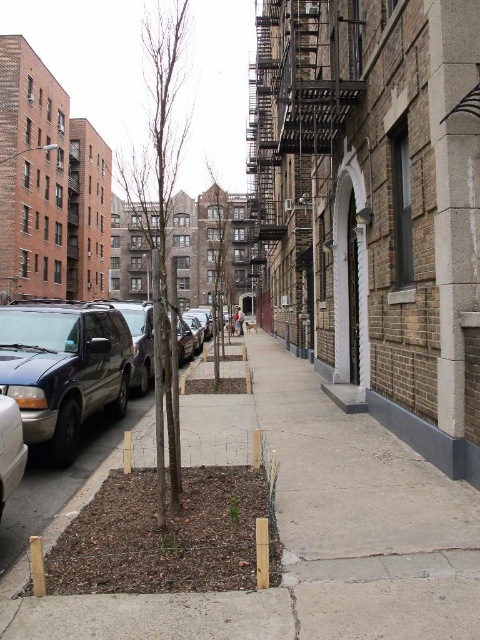
Is point (15, 312) farther from camera compared to point (214, 250)?

No, it is not.

Who is positioned more to the left, metallic blue van at left or green matte tree at center?

From the viewer's perspective, green matte tree at center appears more on the left side.

Which is behind, point (47, 352) or point (218, 310)?

Point (218, 310)

Locate an element on the screen. This screenshot has width=480, height=640. metallic blue van at left is located at coordinates (63, 369).

Who is taller, brown dirt at center or matte black van at left?

Standing taller between the two is matte black van at left.

Consider the image. Is the position of brown dirt at center more distant than that of matte black van at left?

No, brown dirt at center is closer to the viewer.

Who is more forward, [297,404] or [3,429]?

Point [3,429] is more forward.

Locate an element on the screen. The height and width of the screenshot is (640, 480). brown dirt at center is located at coordinates (308, 532).

Where is `bare wood tree at center`? Image resolution: width=480 pixels, height=640 pixels. bare wood tree at center is located at coordinates (160, 218).

Is bare wood tree at center smaller than green matte tree at center?

Incorrect, bare wood tree at center is not smaller in size than green matte tree at center.

Who is more distant from viewer, (165,124) or (218,236)?

The point (218,236) is more distant.

At what (x,y) coordinates should I click in order to perform the action: click on bare wood tree at center. Please return your answer as a coordinate pair (x, y). Looking at the image, I should click on (160, 218).